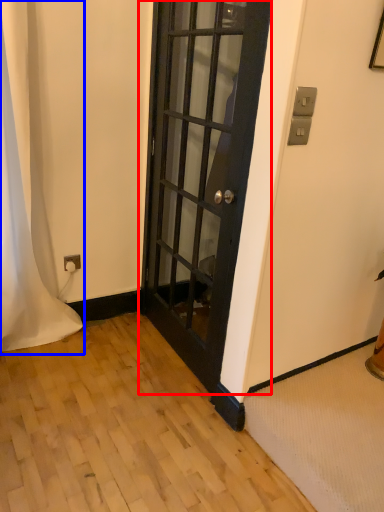
Question: Which of the following is the closest to the observer, door (highlighted by a red box) or curtain (highlighted by a blue box)?

Choices:
 (A) door
 (B) curtain

Answer: (A)